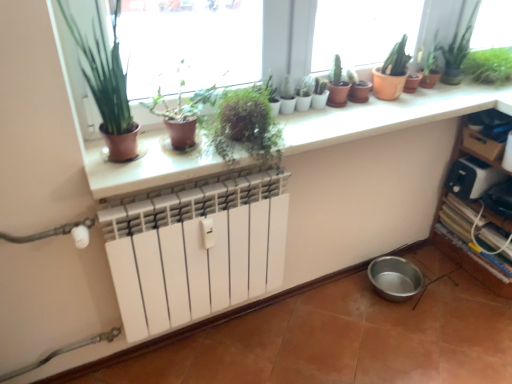
In order to click on vacant region under white matte radiator at center (from a real-world perspective) in this screenshot , I will do click(x=174, y=349).